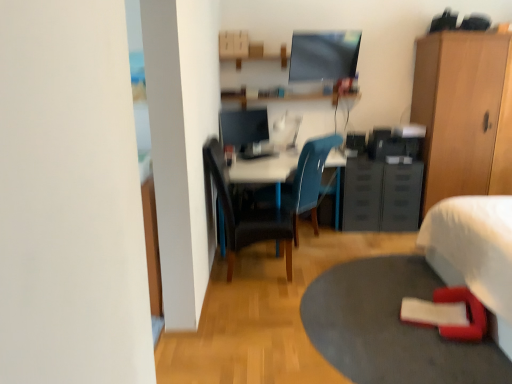
Question: Can you confirm if black leather chair at center, which appears as the 2th chair when viewed from the back, is taller than white glossy computer desk at center?

Choices:
 (A) no
 (B) yes

Answer: (B)

Question: Is black leather chair at center, which appears as the 2th chair when viewed from the back, to the left of white glossy computer desk at center from the viewer's perspective?

Choices:
 (A) no
 (B) yes

Answer: (B)

Question: Is black leather chair at center, which appears as the 2th chair when viewed from the back, wider than white glossy computer desk at center?

Choices:
 (A) yes
 (B) no

Answer: (B)

Question: Considering the relative sizes of black leather chair at center, placed as the first chair when sorted from front to back, and white glossy computer desk at center in the image provided, is black leather chair at center, placed as the first chair when sorted from front to back, bigger than white glossy computer desk at center?

Choices:
 (A) no
 (B) yes

Answer: (A)

Question: Considering the relative sizes of black leather chair at center, which appears as the 2th chair when viewed from the back, and white glossy computer desk at center in the image provided, is black leather chair at center, which appears as the 2th chair when viewed from the back, smaller than white glossy computer desk at center?

Choices:
 (A) no
 (B) yes

Answer: (B)

Question: In the image, is satin black monitor at center on the left side or the right side of wooden cabinet at right?

Choices:
 (A) right
 (B) left

Answer: (B)

Question: Considering their positions, is satin black monitor at center located in front of or behind wooden cabinet at right?

Choices:
 (A) behind
 (B) front

Answer: (A)

Question: Looking at their shapes, would you say satin black monitor at center is wider or thinner than wooden cabinet at right?

Choices:
 (A) wide
 (B) thin

Answer: (B)

Question: In terms of height, does satin black monitor at center look taller or shorter compared to wooden cabinet at right?

Choices:
 (A) tall
 (B) short

Answer: (B)

Question: Considering the positions of point (502, 226) and point (353, 322), is point (502, 226) closer or farther from the camera than point (353, 322)?

Choices:
 (A) closer
 (B) farther

Answer: (A)

Question: From a real-world perspective, is white fabric bed at lower right above or below rubberized red mat at lower right?

Choices:
 (A) below
 (B) above

Answer: (B)

Question: Considering their positions, is white fabric bed at lower right located in front of or behind rubberized red mat at lower right?

Choices:
 (A) behind
 (B) front

Answer: (B)

Question: From the image's perspective, is white fabric bed at lower right positioned above or below rubberized red mat at lower right?

Choices:
 (A) above
 (B) below

Answer: (A)

Question: From a real-world perspective, is satin black monitor at center above or below black leather chair at center, placed as the first chair when sorted from front to back?

Choices:
 (A) below
 (B) above

Answer: (B)

Question: From the image's perspective, is satin black monitor at center located above or below black leather chair at center, placed as the first chair when sorted from front to back?

Choices:
 (A) above
 (B) below

Answer: (A)